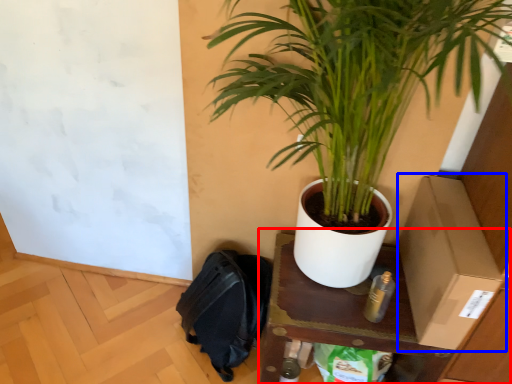
Question: Which point is further to the camera, table (highlighted by a red box) or cardboard box (highlighted by a blue box)?

Choices:
 (A) table
 (B) cardboard box

Answer: (A)